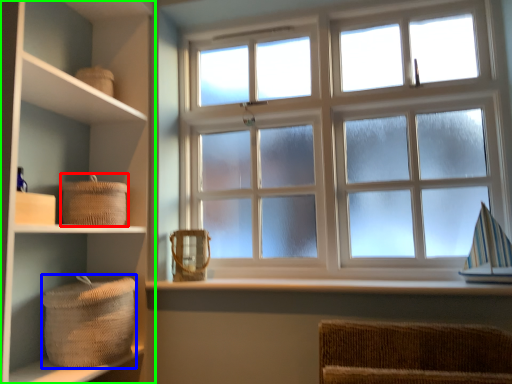
Question: Which is farther away from basket (highlighted by a red box)? basket (highlighted by a blue box) or shelf (highlighted by a green box)?

Choices:
 (A) basket
 (B) shelf

Answer: (A)